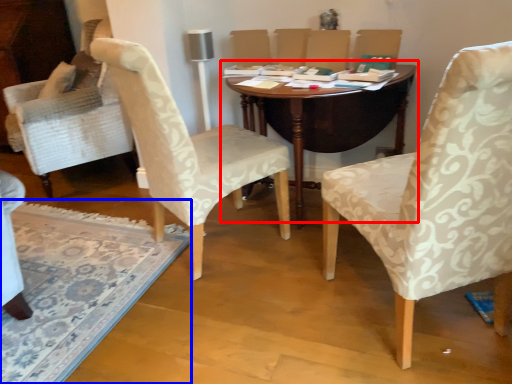
Question: Which point is further to the camera, table (highlighted by a red box) or mat (highlighted by a blue box)?

Choices:
 (A) table
 (B) mat

Answer: (A)